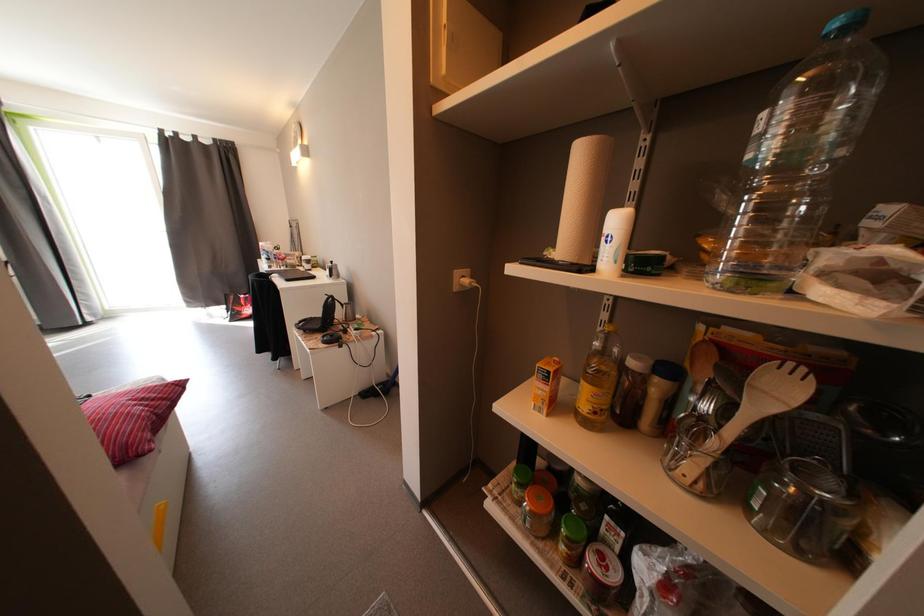
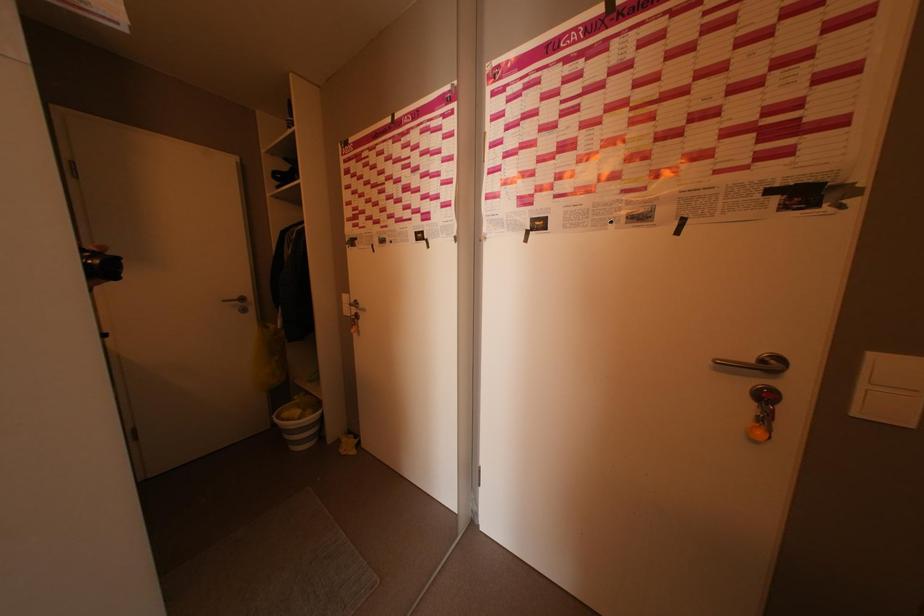
Question: The camera is either moving clockwise (left) or counter-clockwise (right) around the object. The first image is from the beginning of the video and the second image is from the end. Is the camera moving left or right when shooting the video?

Choices:
 (A) Left
 (B) Right

Answer: (A)